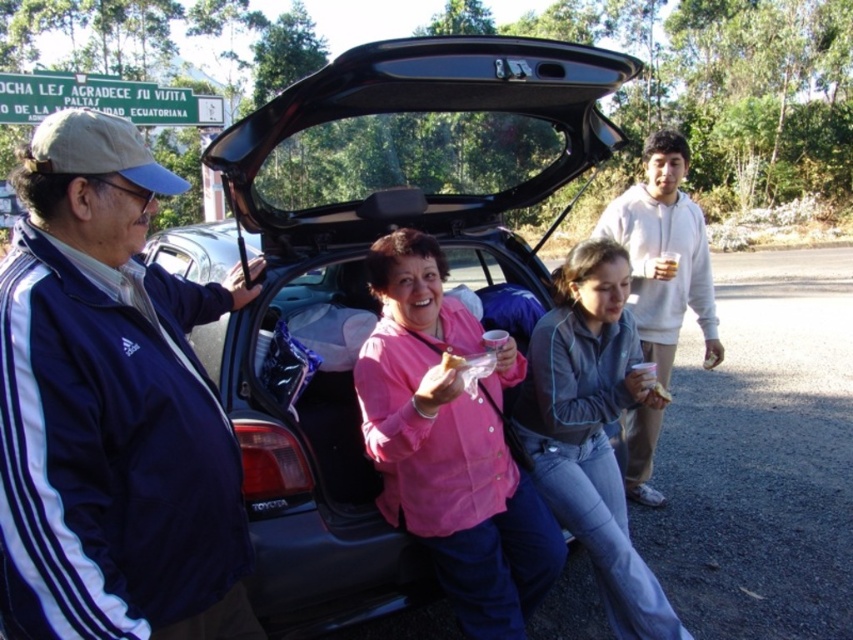
You are organizing a picnic and need to place the pink fabric at center and the smooth plastic sandwich at lower center in your car trunk. Based on their positions in the image, which item is closer to the driver side of the car?

The pink fabric at center is closer to the driver side of the car since it is positioned to the left of the smooth plastic sandwich at lower center.

You are a delivery person who needs to place a large package in the car trunk. The package is too heavy to lift over your head. Can you place the package directly into the black matte car trunk at center without lifting it high, considering the position of the pink fabric at center?

The black matte car trunk at center is above the pink fabric at center, so you can place the package onto the pink fabric at center first and then slide it into the trunk without lifting it high.